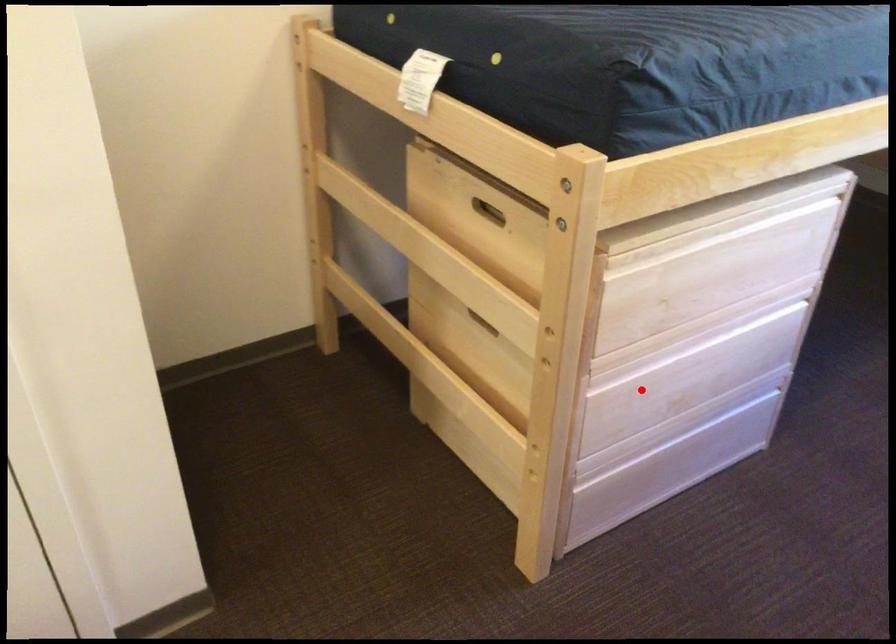
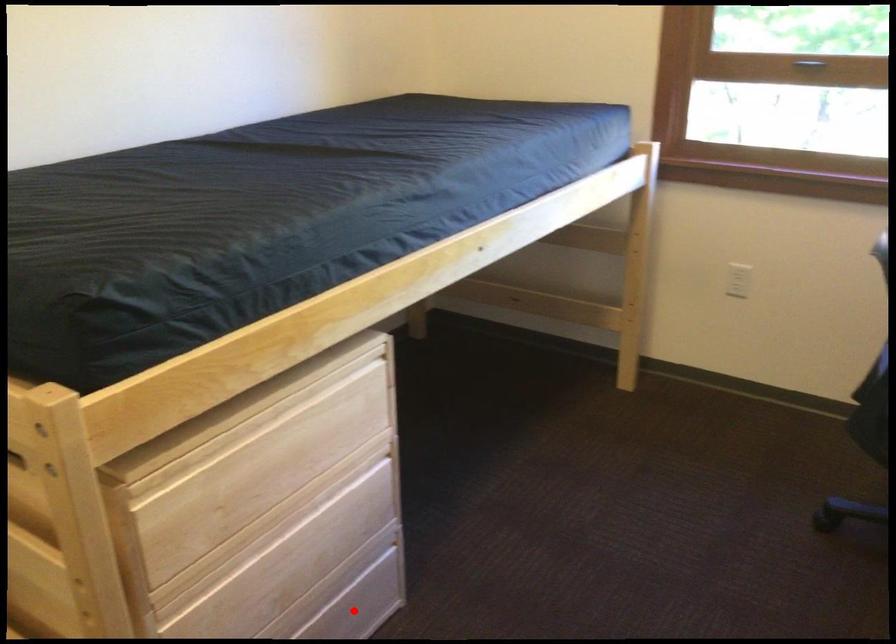
I am providing you with two images of the same scene from different viewpoints. A red point is marked on the first image and another point is marked on the second image. Do the highlighted points in image1 and image2 indicate the same real-world spot?

No